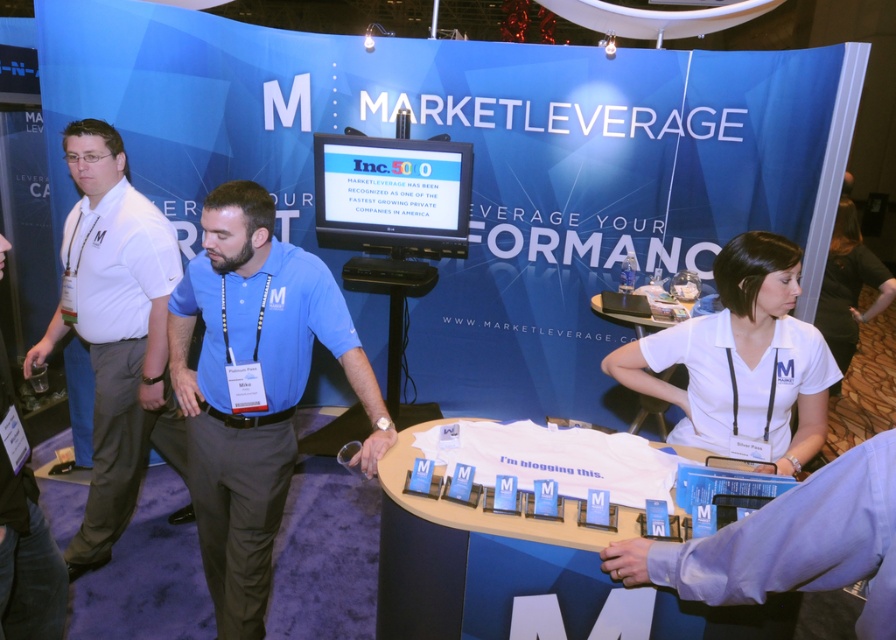
You are a photographer at the event and want to capture the white matte shirt at center and white fabric shirt at right in the same frame. Which shirt should you focus on first to ensure both are in focus?

You should focus on the white matte shirt at center first because it is closer to the viewer than the white fabric shirt at right, so adjusting focus starting from the closer object ensures both will be in focus.

You are standing at the trade show booth and want to place a promotional item on the table. The white matte shirt at center is currently occupying the center of the table. Where should you place the item to ensure it is centered on the table?

The white matte shirt at center is already at the center of the table, so placing the promotional item there would overlap it. To center the item without overlapping, place it at the same coordinates as the white matte shirt at center.